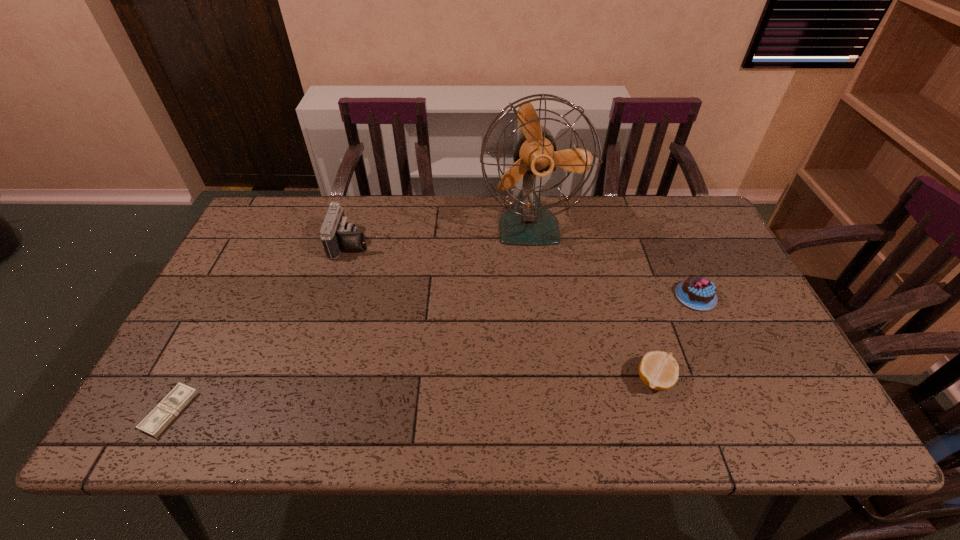
At what (x,y) coordinates should I click in order to perform the action: click on object that is at the near left corner. Please return your answer as a coordinate pair (x, y). Looking at the image, I should click on (162, 415).

Where is `free space at the far edge`? This screenshot has width=960, height=540. free space at the far edge is located at coordinates point(324,196).

At what (x,y) coordinates should I click in order to perform the action: click on vacant space at the right edge of the desktop. Please return your answer as a coordinate pair (x, y). Image resolution: width=960 pixels, height=540 pixels. Looking at the image, I should click on (721, 287).

In the image, there is a desktop. Where is `vacant region at the far right corner`? The width and height of the screenshot is (960, 540). vacant region at the far right corner is located at coordinates (684, 229).

At what (x,y) coordinates should I click in order to perform the action: click on unoccupied position between the camera and the leftmost object. Please return your answer as a coordinate pair (x, y). This screenshot has height=540, width=960. Looking at the image, I should click on (260, 327).

Identify the location of blank region between the second tallest object and the third nearest object. Image resolution: width=960 pixels, height=540 pixels. (523, 269).

Find the location of `free space between the shortest object and the third object from left to right`. free space between the shortest object and the third object from left to right is located at coordinates (349, 319).

What are the coordinates of `free space that is in between the camera and the fan` in the screenshot? It's located at [440, 234].

Where is `empty space that is in between the camera and the third object from right to left`? Image resolution: width=960 pixels, height=540 pixels. empty space that is in between the camera and the third object from right to left is located at coordinates (440, 234).

Where is `vacant space that is in between the rightmost object and the second object from left to right`? The image size is (960, 540). vacant space that is in between the rightmost object and the second object from left to right is located at coordinates (523, 269).